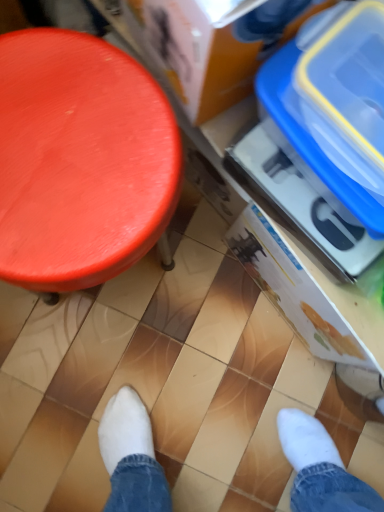
Question: From a real-world perspective, is blue plastic storage box at upper right, the 2th storage box viewed from the back, physically located above or below blue plastic storage box at right, the third storage box viewed from the front?

Choices:
 (A) below
 (B) above

Answer: (B)

Question: Considering the positions of blue plastic storage box at upper right, the 2th storage box viewed from the back, and blue plastic storage box at right, the third storage box viewed from the front, in the image, is blue plastic storage box at upper right, the 2th storage box viewed from the back, taller or shorter than blue plastic storage box at right, the third storage box viewed from the front,?

Choices:
 (A) short
 (B) tall

Answer: (A)

Question: Based on their relative distances, which object is farther from the blue plastic storage box at upper right, positioned as the 1th storage box in front-to-back order?

Choices:
 (A) smooth orange stool at left
 (B) blue plastic storage box at upper right, the 2th storage box positioned from the front
 (C) blue plastic storage box at right, which is the 1th storage box from back to front

Answer: (C)

Question: Based on their relative distances, which object is farther from the blue plastic storage box at upper right, positioned as the 1th storage box in front-to-back order?

Choices:
 (A) blue plastic storage box at upper right, the 2th storage box viewed from the back
 (B) smooth orange stool at left
 (C) blue plastic storage box at right, which is the 1th storage box from back to front

Answer: (C)